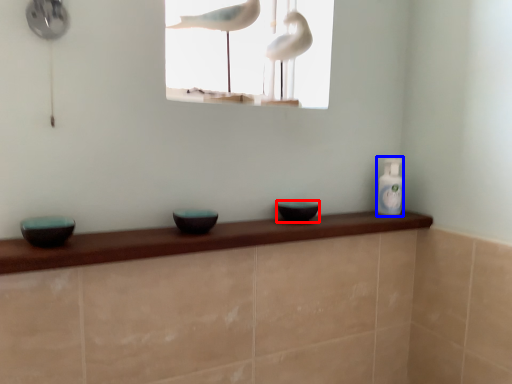
Question: Among these objects, which one is farthest to the camera, basin (highlighted by a red box) or bottle (highlighted by a blue box)?

Choices:
 (A) basin
 (B) bottle

Answer: (B)